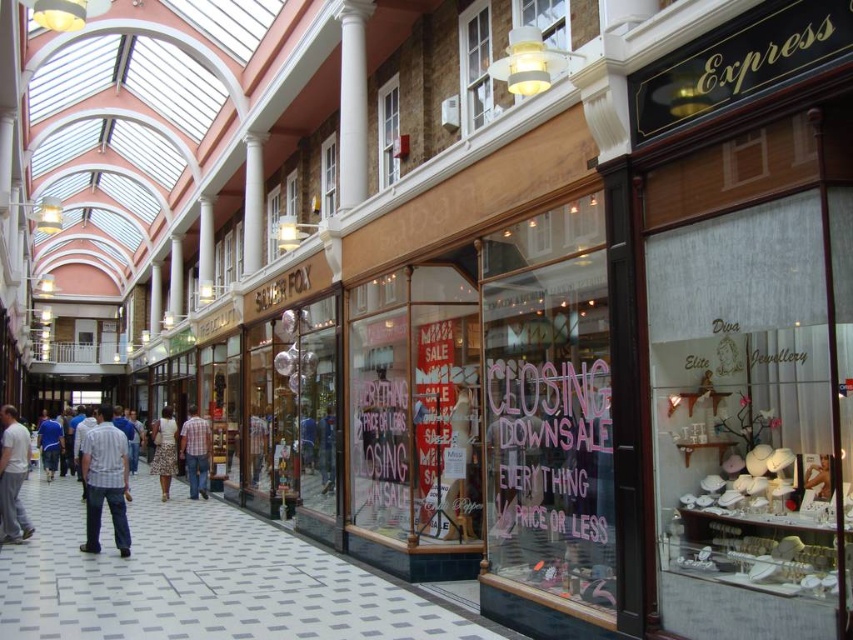
Question: Does transparent glass window at center appear on the left side of striped cotton shirt at center?

Choices:
 (A) yes
 (B) no

Answer: (B)

Question: Which of the following is the closest to the observer?

Choices:
 (A) striped cotton shirt at center
 (B) light gray cotton pants at center
 (C) plaid shirt at center
 (D) light brown shirt at center

Answer: (A)

Question: Does transparent glass window at center have a larger size compared to light gray cotton pants at center?

Choices:
 (A) yes
 (B) no

Answer: (A)

Question: Among these objects, which one is farthest from the camera?

Choices:
 (A) striped cotton shirt at center
 (B) plaid shirt at center

Answer: (B)

Question: Estimate the real-world distances between objects in this image. Which object is farther from the striped cotton shirt at center?

Choices:
 (A) floral skirt at center
 (B) plaid shirt at center

Answer: (B)

Question: Does striped cotton shirt at center have a larger size compared to blue shirt at center?

Choices:
 (A) yes
 (B) no

Answer: (B)